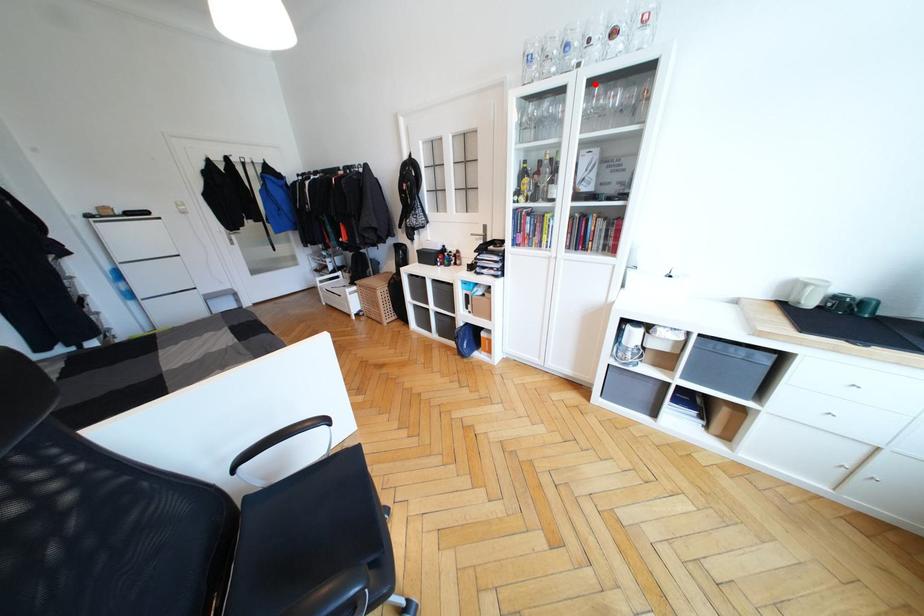
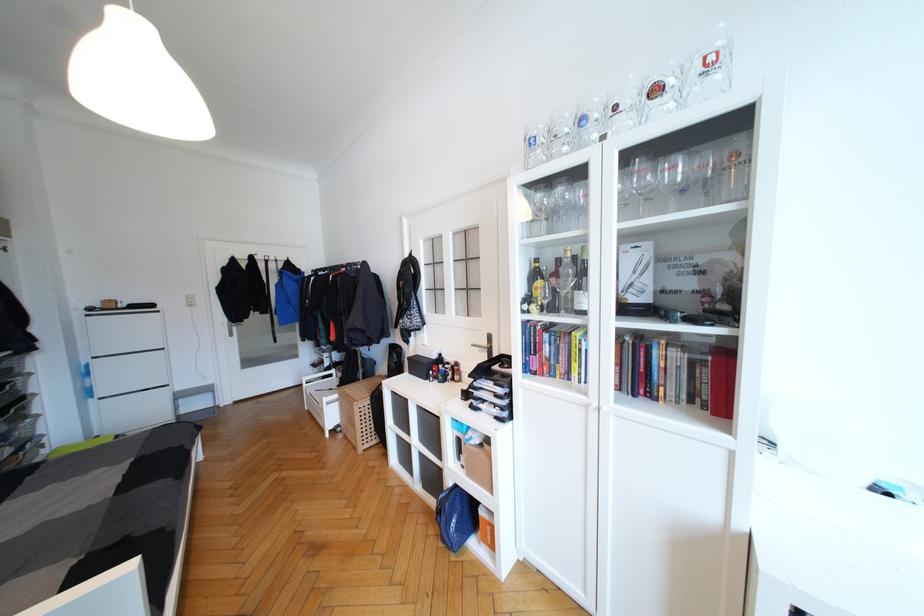
In the second image, find the point that corresponds to the highlighted location in the first image.

(631, 156)